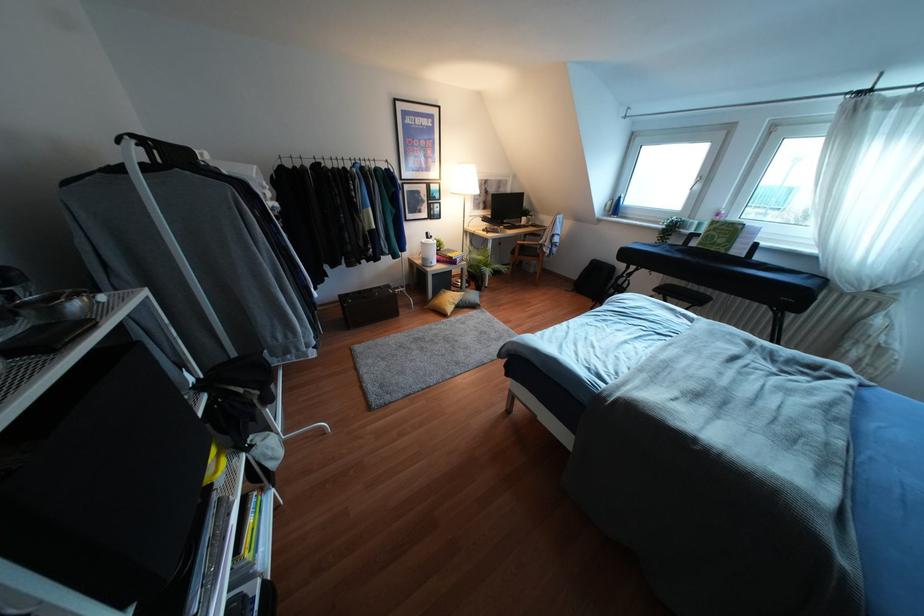
Find where to sit the black stool. Please return your answer as a coordinate pair (x, y).

(682, 294)